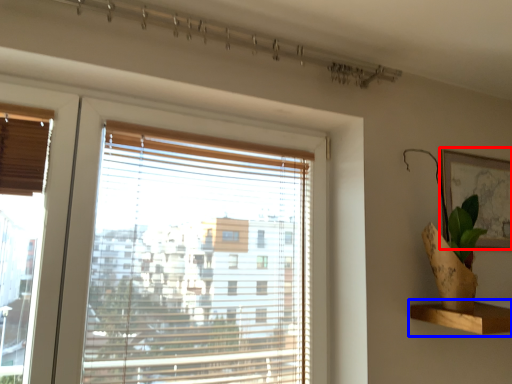
Question: Which of the following is the farthest to the observer, picture frame (highlighted by a red box) or shelf (highlighted by a blue box)?

Choices:
 (A) picture frame
 (B) shelf

Answer: (A)